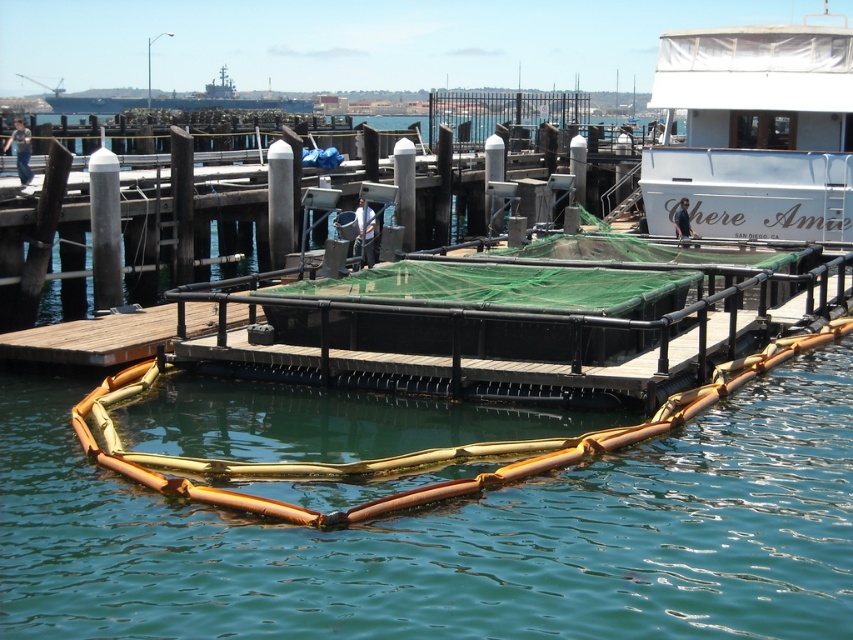
Can you confirm if brown rubber barrier at center is smaller than white matte boat at upper right?

Actually, brown rubber barrier at center might be larger than white matte boat at upper right.

Is brown rubber barrier at center to the left of white matte boat at upper right from the viewer's perspective?

Correct, you'll find brown rubber barrier at center to the left of white matte boat at upper right.

At what (x,y) coordinates should I click in order to perform the action: click on brown rubber barrier at center. Please return your answer as a coordinate pair (x, y). This screenshot has height=640, width=853. Looking at the image, I should click on (457, 538).